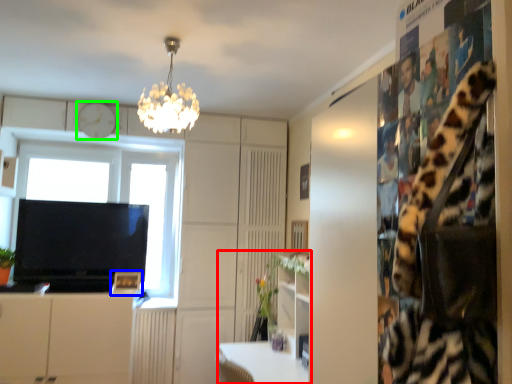
Question: Based on their relative distances, which object is nearer to computer desk (highlighted by a red box)? Choose from picture frame (highlighted by a blue box) and clock (highlighted by a green box).

Choices:
 (A) picture frame
 (B) clock

Answer: (A)